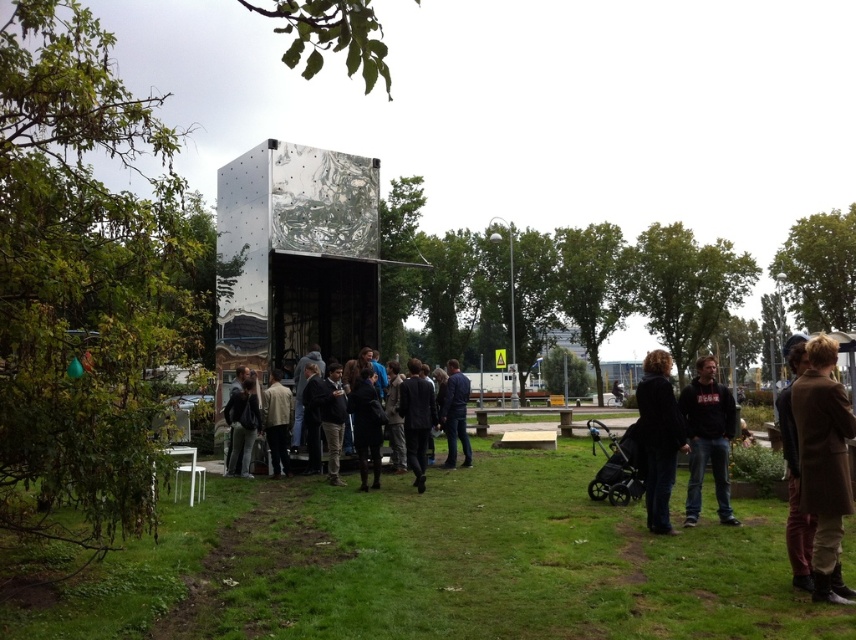
Question: Which of the following is the farthest from the observer?

Choices:
 (A) (144, 621)
 (B) (805, 509)
 (C) (648, 460)
 (D) (429, 397)

Answer: (D)

Question: Which point is closer to the camera?

Choices:
 (A) green grass at center
 (B) dark blue jacket at center
 (C) black fur coat at lower right

Answer: (C)

Question: Estimate the real-world distances between objects in this image. Which object is closer to the brown wool coat at lower right?

Choices:
 (A) dark gray suit at center
 (B) dark blue jacket at center

Answer: (A)

Question: Is black fur coat at lower right wider than silver metallic stroller at lower right?

Choices:
 (A) no
 (B) yes

Answer: (B)

Question: Does green grass at center have a lesser width compared to dark gray suit at center?

Choices:
 (A) yes
 (B) no

Answer: (A)

Question: Does brown leather coat at lower right appear on the left side of blue denim jacket at center?

Choices:
 (A) no
 (B) yes

Answer: (A)